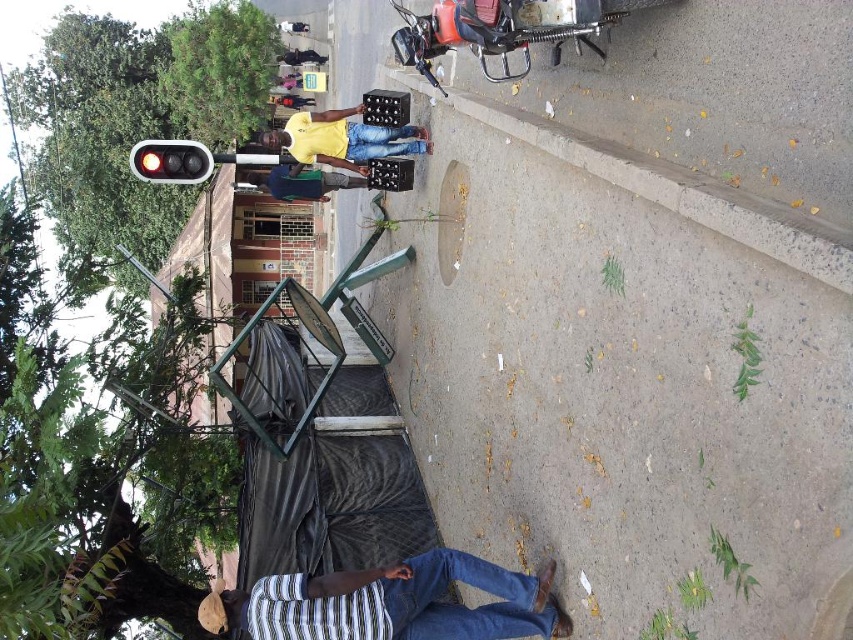
You are a pedestrian standing at the crosswalk and see a man in a striped fabric shirt at lower center and a man in a yellow matte shirt at center. Which man is positioned more to the right side of the crosswalk?

The striped fabric shirt at lower center is to the right of the yellow matte shirt at center, so the man in the striped fabric shirt at lower center is positioned more to the right side of the crosswalk.

You are a pedestrian trying to cross the street. You see two pairs of dark blue jeans at center and dark blue jeans at upper center. Which pair is closer to you?

The dark blue jeans at center is taller than dark blue jeans at upper center, so the dark blue jeans at center is closer to you.